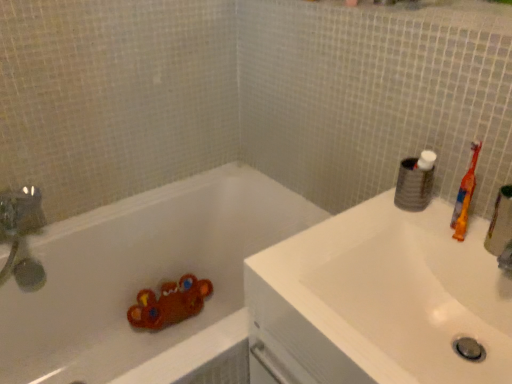
Question: In terms of size, does white matte bathtub at lower left appear bigger or smaller than white glossy sink at upper right?

Choices:
 (A) big
 (B) small

Answer: (A)

Question: Does point (110, 261) appear closer or farther from the camera than point (328, 352)?

Choices:
 (A) closer
 (B) farther

Answer: (B)

Question: Which is farther from the orange plastic toothbrush at right?

Choices:
 (A) white matte toilet paper at upper right
 (B) white matte bathtub at lower left
 (C) white glossy sink at upper right

Answer: (B)

Question: Which object is positioned farthest from the white glossy sink at upper right?

Choices:
 (A) white matte toilet paper at upper right
 (B) orange plastic toothbrush at right
 (C) white matte bathtub at lower left

Answer: (C)